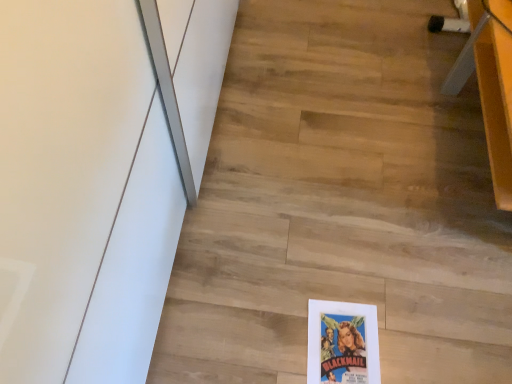
Where is `vacant area situated below wooden desk at upper right (from a real-world perspective)`? Image resolution: width=512 pixels, height=384 pixels. vacant area situated below wooden desk at upper right (from a real-world perspective) is located at coordinates (471, 153).